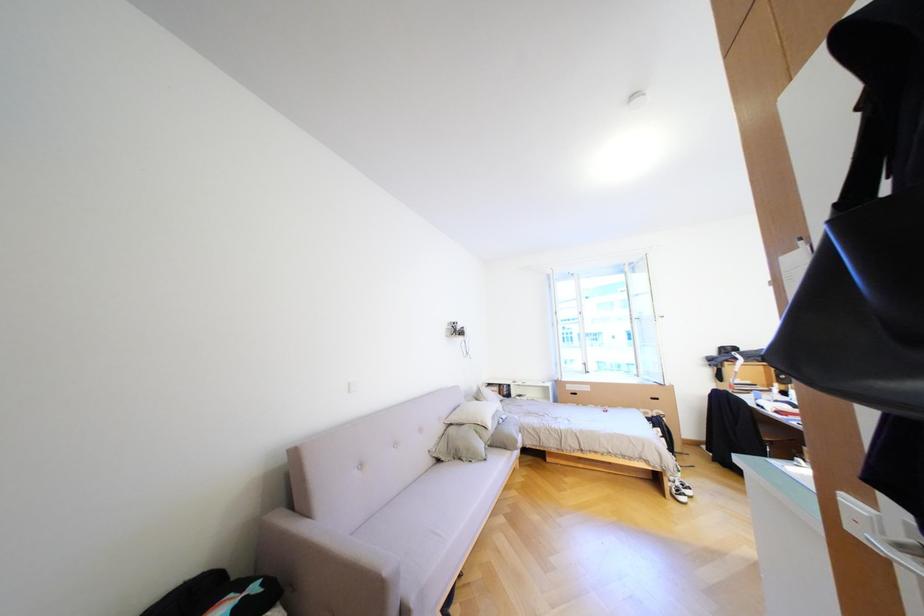
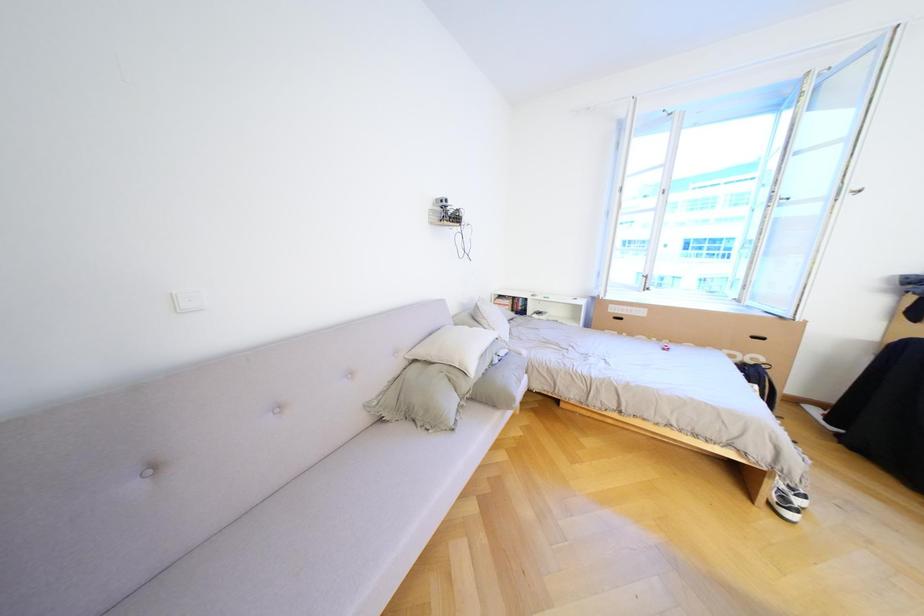
Question: Which direction would the cameraman need to move to produce the second image? Reply with the corresponding letter.

Choices:
 (A) Left
 (B) Right
 (C) Forward
 (D) Backward

Answer: (C)